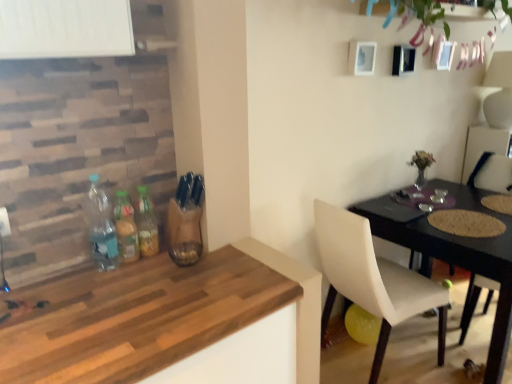
Question: Is white leather chair at lower right, arranged as the second chair when viewed from the right, positioned with its back to translucent glass bottles at center, which appears as the first bottle when viewed from the right?

Choices:
 (A) yes
 (B) no

Answer: (A)

Question: Does white leather chair at lower right, placed as the 1th chair when sorted from left to right, turn towards translucent glass bottles at center, which appears as the first bottle when viewed from the right?

Choices:
 (A) no
 (B) yes

Answer: (A)

Question: From a real-world perspective, does white leather chair at lower right, placed as the 1th chair when sorted from left to right, stand above translucent glass bottles at center, the third bottle viewed from the left?

Choices:
 (A) yes
 (B) no

Answer: (B)

Question: From the image's perspective, is white leather chair at lower right, arranged as the second chair when viewed from the right, on translucent glass bottles at center, which appears as the first bottle when viewed from the right?

Choices:
 (A) no
 (B) yes

Answer: (A)

Question: Does white leather chair at lower right, placed as the 1th chair when sorted from left to right, have a larger size compared to translucent glass bottles at center, the third bottle viewed from the left?

Choices:
 (A) no
 (B) yes

Answer: (B)

Question: Can you confirm if white leather chair at lower right, placed as the 1th chair when sorted from left to right, is shorter than translucent glass bottles at center, which appears as the first bottle when viewed from the right?

Choices:
 (A) no
 (B) yes

Answer: (A)

Question: Considering the relative sizes of wooden table at lower left and translucent glass bottles at center, the third bottle viewed from the left, in the image provided, is wooden table at lower left thinner than translucent glass bottles at center, the third bottle viewed from the left,?

Choices:
 (A) no
 (B) yes

Answer: (A)

Question: From the image's perspective, is wooden table at lower left below translucent glass bottles at center, which appears as the first bottle when viewed from the right?

Choices:
 (A) no
 (B) yes

Answer: (B)

Question: Is the position of wooden table at lower left more distant than that of translucent glass bottles at center, which appears as the first bottle when viewed from the right?

Choices:
 (A) yes
 (B) no

Answer: (B)

Question: Can you confirm if wooden table at lower left is positioned to the right of translucent glass bottles at center, the third bottle viewed from the left?

Choices:
 (A) yes
 (B) no

Answer: (A)

Question: Is wooden table at lower left turned away from translucent glass bottles at center, the third bottle viewed from the left?

Choices:
 (A) no
 (B) yes

Answer: (A)

Question: From a real-world perspective, is wooden table at lower left over translucent glass bottles at center, which appears as the first bottle when viewed from the right?

Choices:
 (A) no
 (B) yes

Answer: (A)

Question: Can you confirm if green leafy plant at upper center is bigger than wooden table at lower left?

Choices:
 (A) no
 (B) yes

Answer: (A)